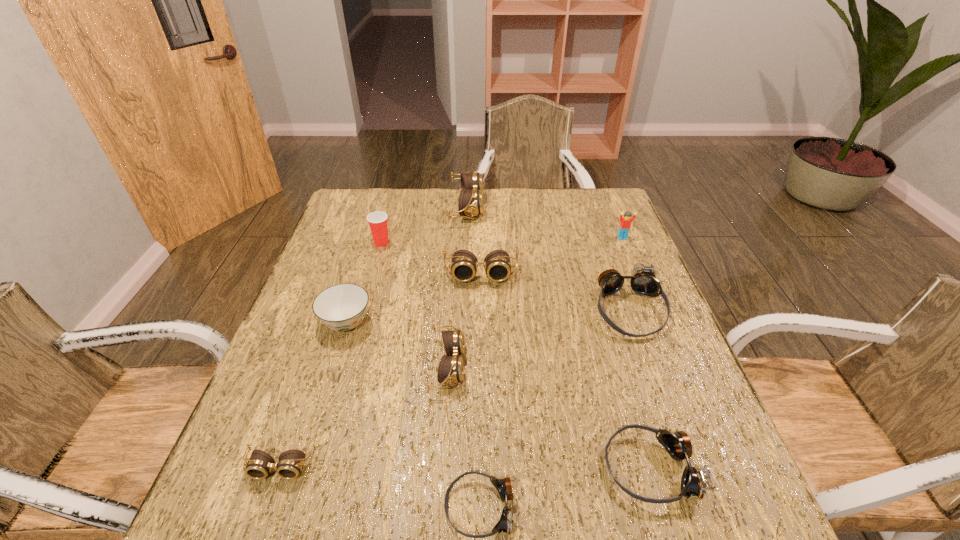
The image size is (960, 540). I want to click on free space between the farthest bronze goggles and the soup bowl, so click(488, 316).

Image resolution: width=960 pixels, height=540 pixels. I want to click on free space between the biggest brown goggles and the second farthest brown goggles, so click(x=473, y=241).

Where is `free space between the second smallest bronze goggles and the third farthest brown goggles`? This screenshot has width=960, height=540. free space between the second smallest bronze goggles and the third farthest brown goggles is located at coordinates (549, 417).

What are the coordinates of `the fourth closest object relative to the farthest bronze goggles` in the screenshot? It's located at (450, 370).

At what (x,y) coordinates should I click in order to perform the action: click on object that is the sixth closest to the smallest bronze goggles. Please return your answer as a coordinate pair (x, y). The height and width of the screenshot is (540, 960). Looking at the image, I should click on (464, 264).

At what (x,y) coordinates should I click in order to perform the action: click on goggles that is the closest one to the third nearest brown goggles. Please return your answer as a coordinate pair (x, y). The image size is (960, 540). Looking at the image, I should click on (470, 203).

Select which goggles is the second closest to the farthest bronze goggles. Please provide its 2D coordinates. Your answer should be formatted as a tuple, i.e. [(x, y)], where the tuple contains the x and y coordinates of a point satisfying the conditions above.

[(693, 483)]

Identify the location of the third closest brown goggles to the biggest bronze goggles. The height and width of the screenshot is (540, 960). (470, 203).

Identify which brown goggles is located as the nearest to the second biggest bronze goggles. Please provide its 2D coordinates. Your answer should be formatted as a tuple, i.e. [(x, y)], where the tuple contains the x and y coordinates of a point satisfying the conditions above.

[(450, 370)]

Where is `bronze goggles identified as the third closest to the soup bowl`? The width and height of the screenshot is (960, 540). bronze goggles identified as the third closest to the soup bowl is located at coordinates (643, 281).